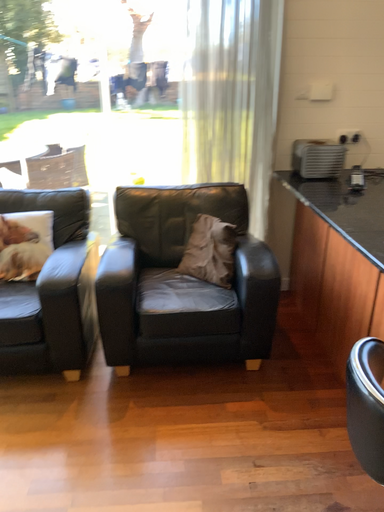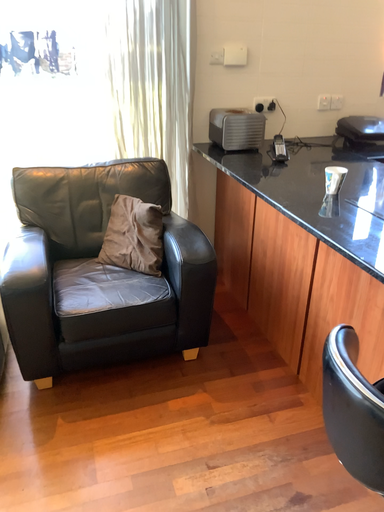
Question: How did the camera likely rotate when shooting the video?

Choices:
 (A) rotated left
 (B) rotated right

Answer: (B)